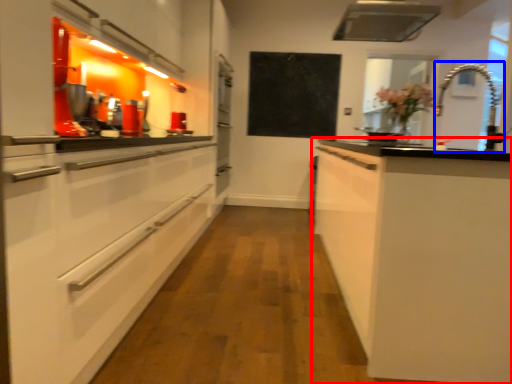
Question: Among these objects, which one is farthest to the camera, cabinetry (highlighted by a red box) or faucet (highlighted by a blue box)?

Choices:
 (A) cabinetry
 (B) faucet

Answer: (B)